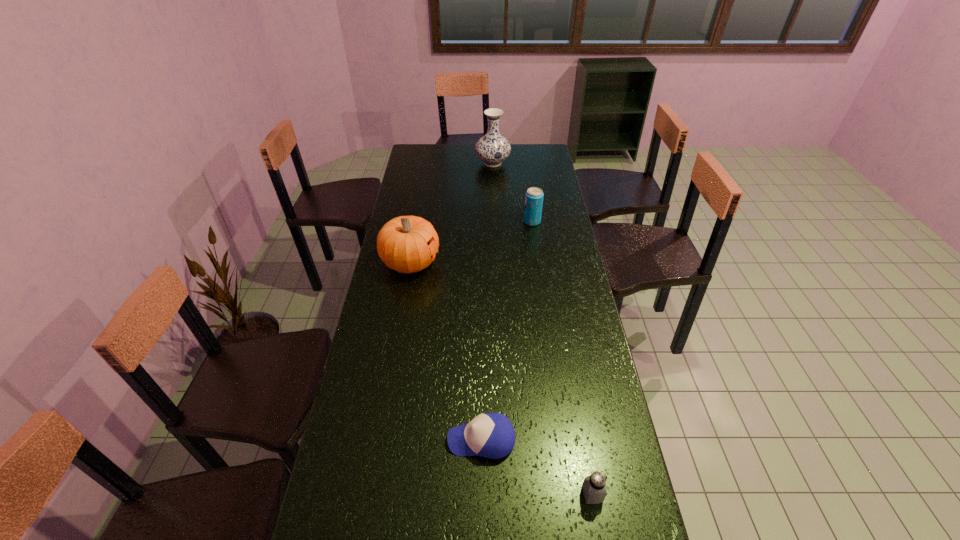
I want to click on vacant space located 0.050m on the left of the third tallest object, so click(x=513, y=221).

Where is `vacant region located 0.230m on the back of the nearest object`? vacant region located 0.230m on the back of the nearest object is located at coordinates (576, 404).

You are a GUI agent. You are given a task and a screenshot of the screen. Output one action in this format:
    pyautogui.click(x=<x>, y=<y>)
    Task: Click on the blank space located on the front-facing side of the second nearest object
    The height and width of the screenshot is (540, 960).
    Given the screenshot: What is the action you would take?
    pyautogui.click(x=356, y=440)

Image resolution: width=960 pixels, height=540 pixels. I want to click on free space located 0.170m on the front-facing side of the second nearest object, so click(386, 440).

This screenshot has height=540, width=960. I want to click on vacant space located on the front-facing side of the second nearest object, so (429, 440).

This screenshot has height=540, width=960. I want to click on object that is at the far edge, so tap(492, 148).

Identify the location of object situated at the left edge. The width and height of the screenshot is (960, 540). (407, 244).

Locate an element on the screen. soda can that is at the right edge is located at coordinates (534, 196).

Locate an element on the screen. The image size is (960, 540). saltshaker that is at the right edge is located at coordinates (594, 486).

This screenshot has width=960, height=540. In the image, there is a desktop. What are the coordinates of `vacant space at the far edge` in the screenshot? It's located at (517, 148).